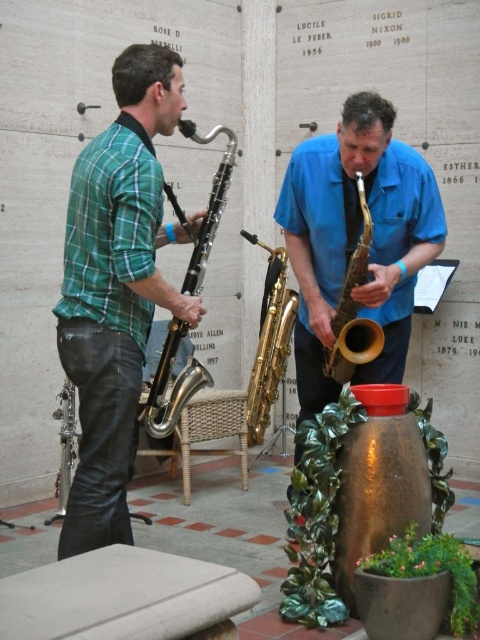
Question: Which of the following is the closest to the observer?

Choices:
 (A) (305, 394)
 (B) (363, 188)

Answer: (B)

Question: Can you confirm if metallic silver saxophone at left is smaller than gold brass saxophone at center?

Choices:
 (A) no
 (B) yes

Answer: (B)

Question: Is the position of green plaid shirt at left more distant than that of gold/yellow wood saxophone at center?

Choices:
 (A) yes
 (B) no

Answer: (B)

Question: In this image, where is green plaid shirt at left located relative to metallic silver saxophone at left?

Choices:
 (A) right
 (B) left

Answer: (B)

Question: Among these points, which one is nearest to the camera?

Choices:
 (A) (194, 250)
 (B) (253, 429)

Answer: (A)

Question: Among these points, which one is nearest to the camera?

Choices:
 (A) pyautogui.click(x=172, y=362)
 (B) pyautogui.click(x=305, y=227)
 (C) pyautogui.click(x=121, y=515)

Answer: (C)